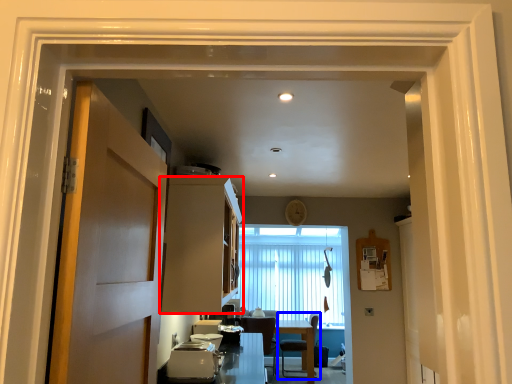
Question: Which point is closer to the camera, cabinetry (highlighted by a red box) or chair (highlighted by a blue box)?

Choices:
 (A) cabinetry
 (B) chair

Answer: (A)